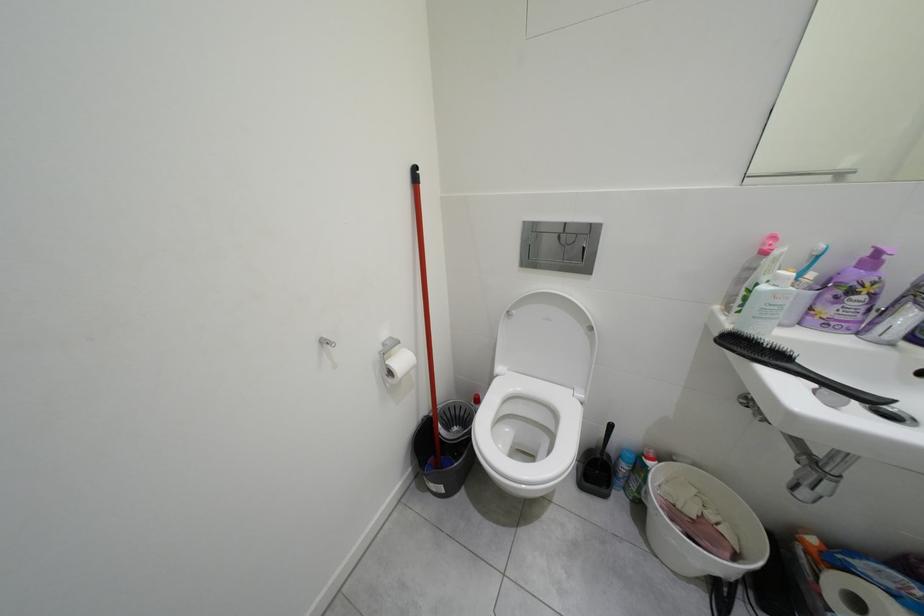
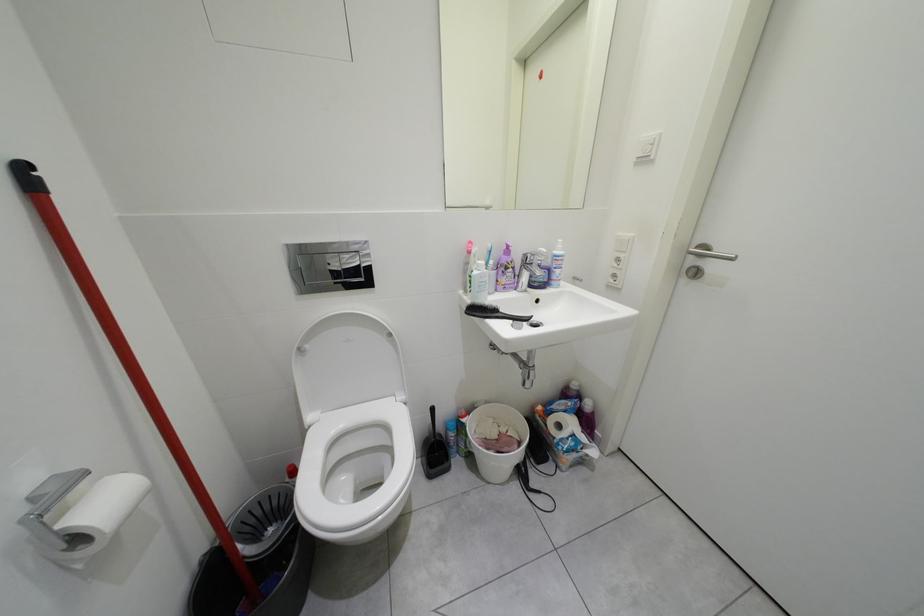
Question: The camera is either moving clockwise (left) or counter-clockwise (right) around the object. The first image is from the beginning of the video and the second image is from the end. Is the camera moving left or right when shooting the video?

Choices:
 (A) Left
 (B) Right

Answer: (A)